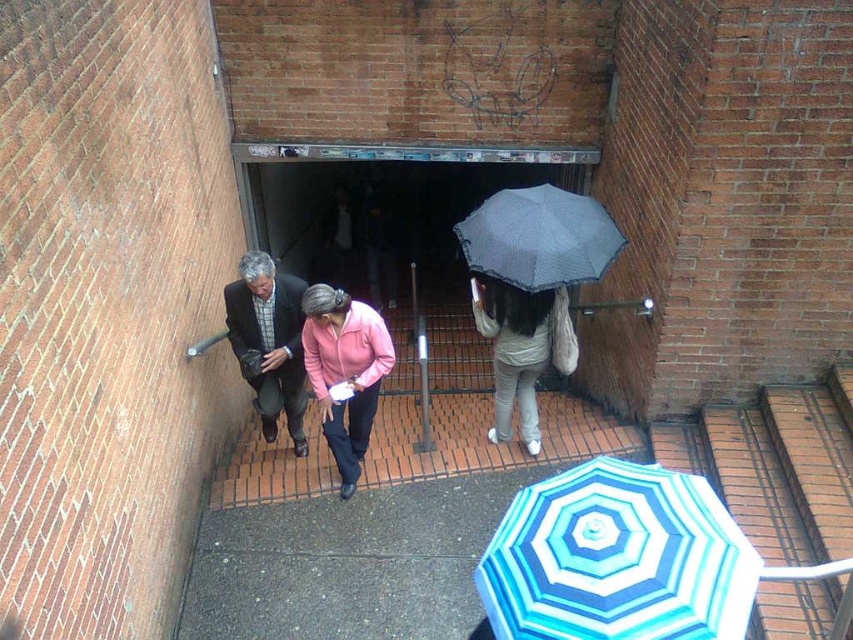
You are standing at the entrance of the tunnel and notice a blue striped umbrella at lower right and a dark gray suit at center. Which object is nearer to you?

The blue striped umbrella at lower right is closer to the viewer than the dark gray suit at center.

You are a pedestrian carrying a large package and need to walk through the narrow passageway. You see a blue striped umbrella at lower right and a light gray fabric umbrella at center. Which umbrella should you avoid to prevent blocking the path?

You should avoid the blue striped umbrella at lower right because it has a larger size compared to the light gray fabric umbrella at center, making it more likely to block the path.